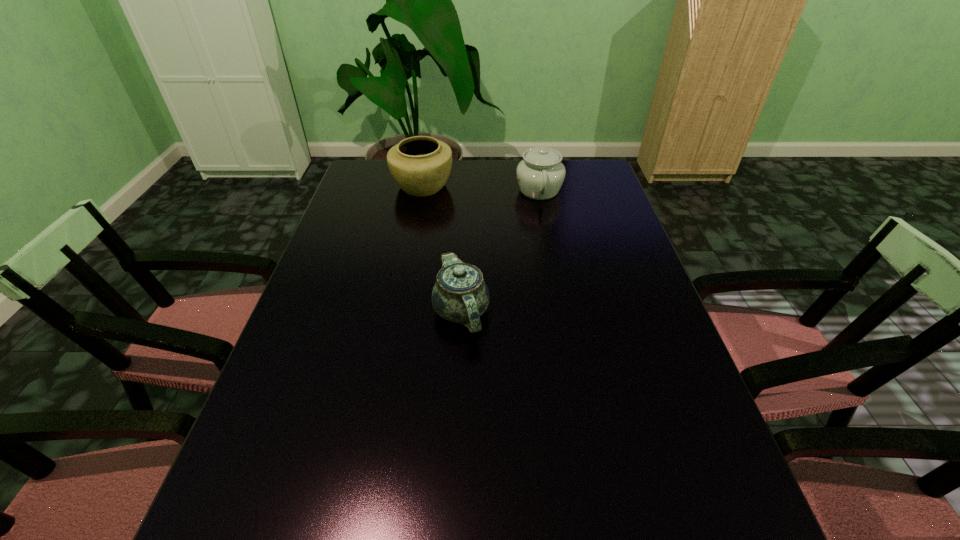
I want to click on object that ranks as the second closest to the pottery, so click(460, 295).

Identify the location of vacant area in the image that satisfies the following two spatial constraints: 1. on the front side of the rightmost object; 2. on the left side of the pottery. The height and width of the screenshot is (540, 960). (421, 190).

Find the location of `free spot that satisfies the following two spatial constraints: 1. on the front side of the pottery; 2. on the right side of the farther chinaware`. free spot that satisfies the following two spatial constraints: 1. on the front side of the pottery; 2. on the right side of the farther chinaware is located at coordinates (421, 190).